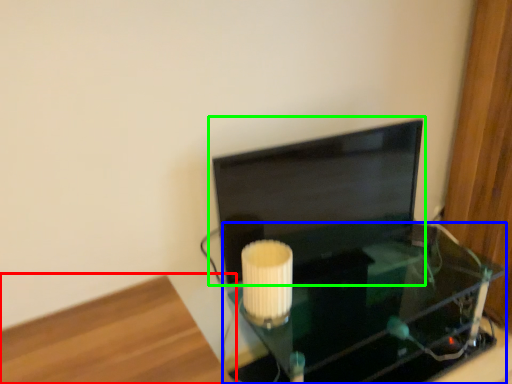
Question: Which object is positioned closest to furniture (highlighted by a red box)? Select from table (highlighted by a blue box) and computer monitor (highlighted by a green box).

Choices:
 (A) table
 (B) computer monitor

Answer: (B)